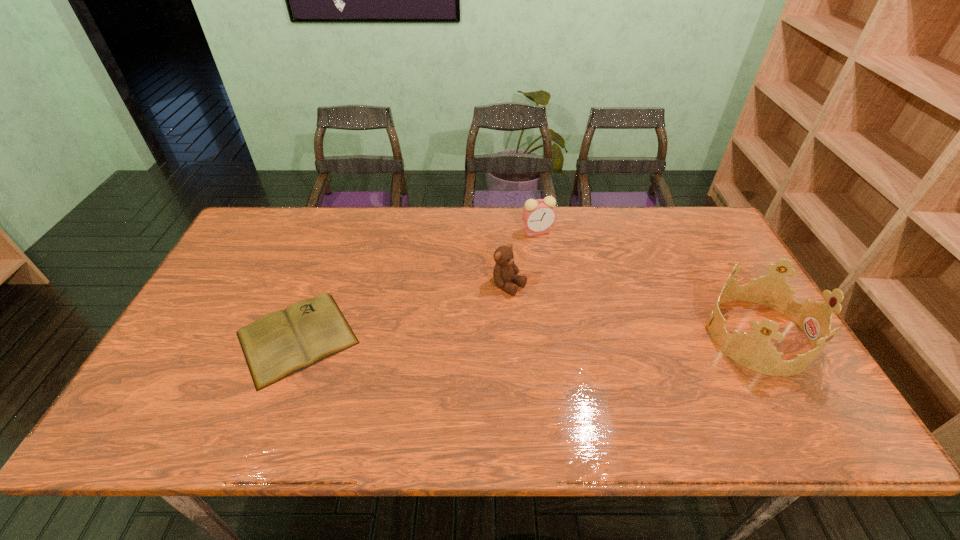
The image size is (960, 540). In order to click on free space located 0.070m on the face of the farthest object in this screenshot , I will do `click(523, 249)`.

Where is `vacant space located 0.250m on the face of the second object from left to right`? The width and height of the screenshot is (960, 540). vacant space located 0.250m on the face of the second object from left to right is located at coordinates (600, 340).

The width and height of the screenshot is (960, 540). I want to click on free location located on the face of the second object from left to right, so click(562, 317).

Locate an element on the screen. The image size is (960, 540). free region located 0.150m on the face of the second object from left to right is located at coordinates (567, 321).

Where is `object located at the far edge`? object located at the far edge is located at coordinates (538, 215).

This screenshot has width=960, height=540. I want to click on book that is at the near edge, so pos(283,342).

Image resolution: width=960 pixels, height=540 pixels. Find the location of `tiara that is positioned at the near edge`. tiara that is positioned at the near edge is located at coordinates (754, 351).

Where is `object present at the left edge`? Image resolution: width=960 pixels, height=540 pixels. object present at the left edge is located at coordinates (283, 342).

Find the location of a particular element. object that is positioned at the right edge is located at coordinates (754, 351).

This screenshot has width=960, height=540. I want to click on object at the near left corner, so click(283, 342).